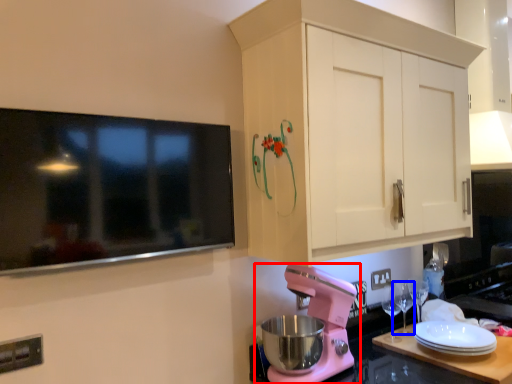
Question: Which object appears closest to the camera in this image, mixer (highlighted by a red box) or wine glass (highlighted by a blue box)?

Choices:
 (A) mixer
 (B) wine glass

Answer: (A)